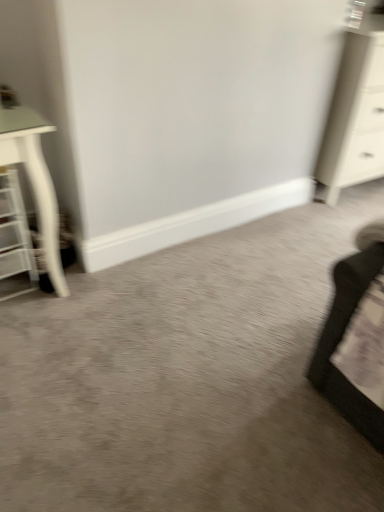
The width and height of the screenshot is (384, 512). Describe the element at coordinates (355, 118) in the screenshot. I see `white glossy chest of drawers at upper right` at that location.

Locate an element on the screen. white glossy chest of drawers at upper right is located at coordinates (355, 118).

At what (x,y) coordinates should I click in order to perform the action: click on white mesh shelf at left. Please return your answer as a coordinate pair (x, y). This screenshot has width=384, height=512. Looking at the image, I should click on (14, 240).

Describe the element at coordinates (14, 240) in the screenshot. This screenshot has width=384, height=512. I see `white mesh shelf at left` at that location.

The width and height of the screenshot is (384, 512). What are the coordinates of `white glossy chest of drawers at upper right` in the screenshot? It's located at (355, 118).

Between white glossy chest of drawers at upper right and white mesh shelf at left, which one appears on the left side from the viewer's perspective?

white mesh shelf at left.

Looking at this image, considering the positions of objects white glossy chest of drawers at upper right and white mesh shelf at left in the image provided, who is behind, white glossy chest of drawers at upper right or white mesh shelf at left?

white glossy chest of drawers at upper right is behind.

Which is further, (382, 57) or (13, 177)?

The point (382, 57) is behind.

From the image's perspective, does white glossy chest of drawers at upper right appear lower than white mesh shelf at left?

Incorrect, from the image's perspective, white glossy chest of drawers at upper right is higher than white mesh shelf at left.

From a real-world perspective, does white glossy chest of drawers at upper right sit lower than white mesh shelf at left?

Incorrect, from a real-world perspective, white glossy chest of drawers at upper right is higher than white mesh shelf at left.

Considering the sizes of objects white glossy chest of drawers at upper right and white mesh shelf at left in the image provided, who is wider, white glossy chest of drawers at upper right or white mesh shelf at left?

Wider between the two is white glossy chest of drawers at upper right.

From their relative heights in the image, would you say white glossy chest of drawers at upper right is taller or shorter than white mesh shelf at left?

In the image, white glossy chest of drawers at upper right appears to be taller than white mesh shelf at left.

Based on the photo, between white glossy chest of drawers at upper right and white mesh shelf at left, which one has smaller size?

white mesh shelf at left.

Is white glossy chest of drawers at upper right positioned beyond the bounds of white mesh shelf at left?

Yes, white glossy chest of drawers at upper right is located beyond the bounds of white mesh shelf at left.

Does white glossy chest of drawers at upper right touch white mesh shelf at left?

white glossy chest of drawers at upper right and white mesh shelf at left are clearly separated.

Is white glossy chest of drawers at upper right oriented towards white mesh shelf at left?

No.

How many degrees apart are the facing directions of white glossy chest of drawers at upper right and white mesh shelf at left?

The angle between the facing direction of white glossy chest of drawers at upper right and the facing direction of white mesh shelf at left is 4.8 degrees.

Locate an element on the screen. The width and height of the screenshot is (384, 512). the chest of drawers that is behind the white mesh shelf at left is located at coordinates (355, 118).

Which is more to the left, white mesh shelf at left or white glossy chest of drawers at upper right?

Positioned to the left is white mesh shelf at left.

Considering their positions, is white mesh shelf at left located in front of or behind white glossy chest of drawers at upper right?

In the image, white mesh shelf at left appears in front of white glossy chest of drawers at upper right.

Is point (5, 287) behind point (336, 130)?

No, it is not.

From the image's perspective, which is above, white mesh shelf at left or white glossy chest of drawers at upper right?

white glossy chest of drawers at upper right.

From a real-world perspective, is white mesh shelf at left physically located above or below white glossy chest of drawers at upper right?

white mesh shelf at left is situated lower than white glossy chest of drawers at upper right in the real world.

Between white mesh shelf at left and white glossy chest of drawers at upper right, which one has larger width?

Wider between the two is white glossy chest of drawers at upper right.

Who is shorter, white mesh shelf at left or white glossy chest of drawers at upper right?

With less height is white mesh shelf at left.

Between white mesh shelf at left and white glossy chest of drawers at upper right, which one has smaller size?

Smaller between the two is white mesh shelf at left.

Is white mesh shelf at left located outside white glossy chest of drawers at upper right?

Yes, white mesh shelf at left is not within white glossy chest of drawers at upper right.

Is white mesh shelf at left far away from white glossy chest of drawers at upper right?

That's right, there is a large distance between white mesh shelf at left and white glossy chest of drawers at upper right.

Is white mesh shelf at left facing away from white glossy chest of drawers at upper right?

No, white mesh shelf at left is not facing away from white glossy chest of drawers at upper right.

How many degrees apart are the facing directions of white mesh shelf at left and white glossy chest of drawers at upper right?

4.8 degrees separate the facing orientations of white mesh shelf at left and white glossy chest of drawers at upper right.

This screenshot has height=512, width=384. What are the coordinates of `the chest of drawers lying behind the white mesh shelf at left` in the screenshot? It's located at (355, 118).

Find the location of a particular element. shelf located below the white glossy chest of drawers at upper right (from the image's perspective) is located at coordinates (14, 240).

This screenshot has width=384, height=512. I want to click on the chest of drawers above the white mesh shelf at left (from the image's perspective), so click(x=355, y=118).